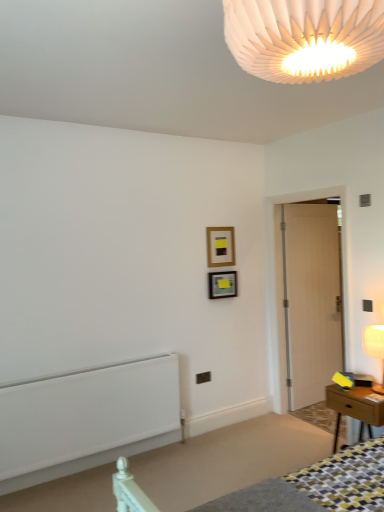
Question: Based on their positions, is matte white lampshade at right, the second lamp viewed from the top, located to the left or right of wooden table at right?

Choices:
 (A) left
 (B) right

Answer: (B)

Question: Is point (379, 329) positioned closer to the camera than point (375, 415)?

Choices:
 (A) farther
 (B) closer

Answer: (A)

Question: Which of these objects is positioned closest to the white pleated paper lampshade at upper center, the first lamp viewed from the front?

Choices:
 (A) wooden table at right
 (B) matte white lampshade at right, which appears as the first lamp when ordered from the bottom
 (C) wooden picture frame at upper center, the 2th picture frame ordered from the bottom
 (D) metallic silver picture frame at upper center, arranged as the 1th picture frame when ordered from the bottom
 (E) white matte radiator at lower left

Answer: (A)

Question: Which object is positioned farthest from the metallic silver picture frame at upper center, arranged as the 1th picture frame when ordered from the bottom?

Choices:
 (A) wooden table at right
 (B) white matte radiator at lower left
 (C) light wood door at right
 (D) wooden picture frame at upper center, acting as the 1th picture frame starting from the top
 (E) white pleated paper lampshade at upper center, which is the second lamp from back to front

Answer: (E)